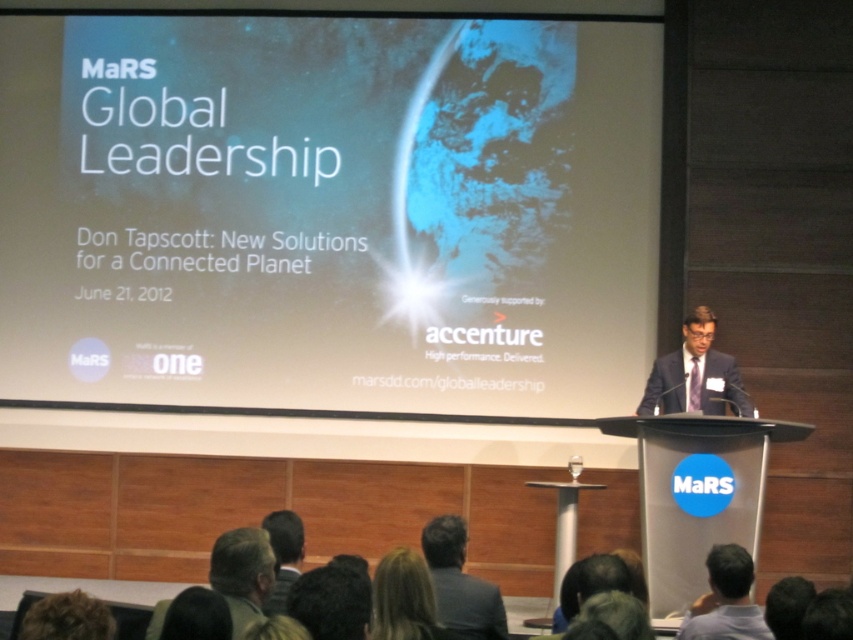
Between dark gray suit at lower center and blonde hair at lower center, which one is positioned higher?

Positioned higher is blonde hair at lower center.

Between dark gray suit at lower center and blonde hair at lower center, which one has more height?

dark gray suit at lower center is taller.

Does point (495, 636) lie in front of point (432, 589)?

That is False.

Find the location of a particular element. Image resolution: width=853 pixels, height=640 pixels. dark gray suit at lower center is located at coordinates (460, 584).

Which is below, dark gray suit at center or blonde hair at lower center?

dark gray suit at center

Which is behind, point (727, 566) or point (390, 634)?

Positioned behind is point (727, 566).

This screenshot has height=640, width=853. What are the coordinates of `dark gray suit at center` in the screenshot? It's located at (726, 600).

Which of these two, dark gray suit at center or dark brown hair at lower center, stands taller?

With more height is dark gray suit at center.

Is point (686, 632) closer to camera compared to point (300, 529)?

Yes, point (686, 632) is in front of point (300, 529).

Where is `dark gray suit at center`? Image resolution: width=853 pixels, height=640 pixels. dark gray suit at center is located at coordinates (726, 600).